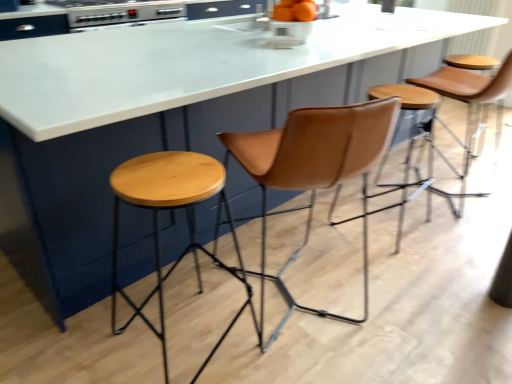
Question: From the image's perspective, is metallic silver oven at upper left above or below leather stool at center, the second stool positioned from the left?

Choices:
 (A) above
 (B) below

Answer: (A)

Question: In terms of width, does metallic silver oven at upper left look wider or thinner when compared to leather stool at center, the second stool positioned from the left?

Choices:
 (A) thin
 (B) wide

Answer: (B)

Question: Considering the real-world distances, which object is closest to the natural wood stool at left, positioned as the 2th stool in right-to-left order?

Choices:
 (A) metallic silver oven at upper left
 (B) leather stool at center, the second stool positioned from the left
 (C) orange matte bowl at center
 (D) brown leather swivel chair at center

Answer: (D)

Question: Which object is positioned farthest from the leather stool at center, the second stool from the front?

Choices:
 (A) natural wood stool at left, the first stool from the front
 (B) orange matte bowl at center
 (C) brown leather swivel chair at center
 (D) metallic silver oven at upper left

Answer: (D)